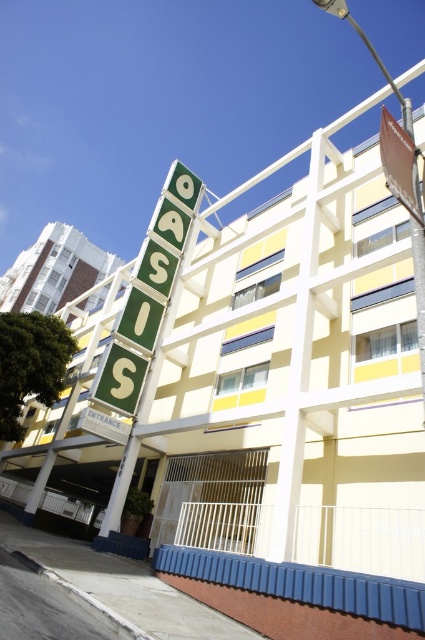
You are a delivery person approaching the building and need to locate the entrance. Based on the image, where would you expect the entrance to be relative to the green matte sign at upper center and the white concrete building at upper left?

The entrance is likely located below the green matte sign at upper center since it is positioned under the white concrete building at upper left, which suggests the sign is part of the building structure, and entrances are typically found lower on the facade.

You are a city planner assessing the visibility of signs in the area. Given the white concrete building at upper left and the brown paper sign at upper right, which object is more likely to be seen from a distance? Explain your reasoning based on their sizes.

The white concrete building at upper left is more likely to be seen from a distance because it has a larger size compared to the brown paper sign at upper right.

You are planning to install a new rectangular advertisement board between the white concrete building at upper left and the brown paper sign at upper right. Which side should the board be placed closer to ensure it fits within the available space between them?

The board should be placed closer to the brown paper sign at upper right because the white concrete building at upper left might be wider than the brown paper sign at upper right, so the space near the narrower object allows for better placement.